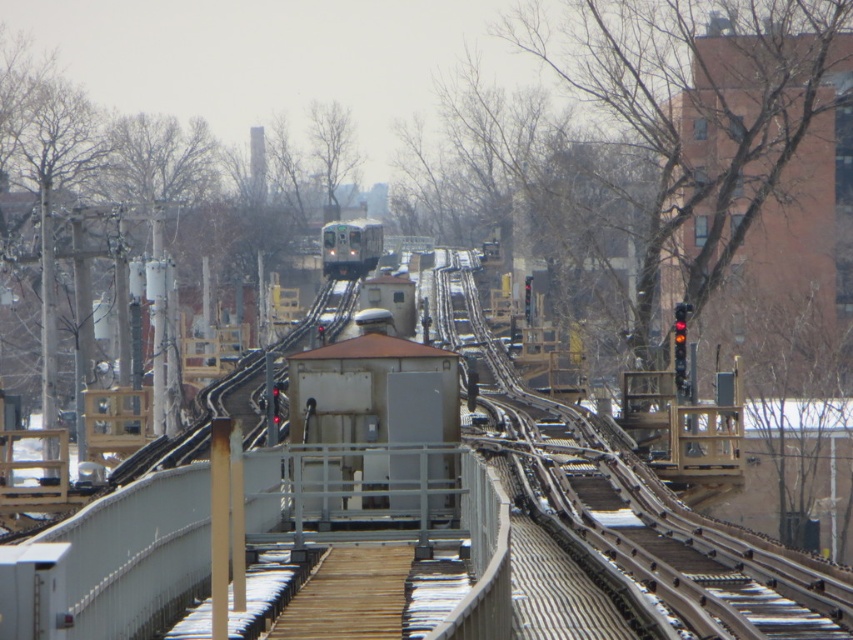
Question: Which point is closer to the camera?

Choices:
 (A) (648, 493)
 (B) (352, 276)

Answer: (A)

Question: Can you confirm if metal train track at center is smaller than green metallic train at center?

Choices:
 (A) no
 (B) yes

Answer: (A)

Question: Can you confirm if metal train track at center is wider than green metallic train at center?

Choices:
 (A) no
 (B) yes

Answer: (B)

Question: Which point is closer to the camera?

Choices:
 (A) metal train track at center
 (B) green metallic train at center

Answer: (A)

Question: Does metal train track at center lie behind green metallic train at center?

Choices:
 (A) yes
 (B) no

Answer: (B)